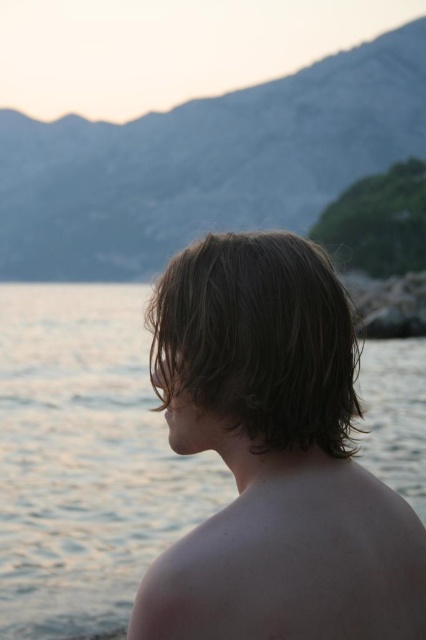
You are a photographer trying to capture the reflection of the two hairstyles in the water. Given that the brown matte hair at center and the dark brown wavy hair at center are both in the frame, which one will have a wider reflection in the water?

The brown matte hair at center will have a wider reflection in the water because its width is larger than the dark brown wavy hair at center.

You are standing at the point closer to the camera between point (287,388) and point (172,552). If you want to walk towards the person in the scene, which direction should you move?

You should move towards point (287,388) because it is closer to the camera, and the person is facing away from the camera towards the water, so moving towards the closer point would bring you closer to the person.

You are a photographer trying to capture the reflection of the pale skin at back in the water. Based on the scene, where should you position your camera to ensure the reflection is visible in the shot?

To capture the reflection of the pale skin at back, position your camera at the same height as the object and aim towards the water surface where the reflection would appear. Since the pale skin at back is located at point 2D coordinates (293, 561), align your camera accordingly to frame the reflection in the water.